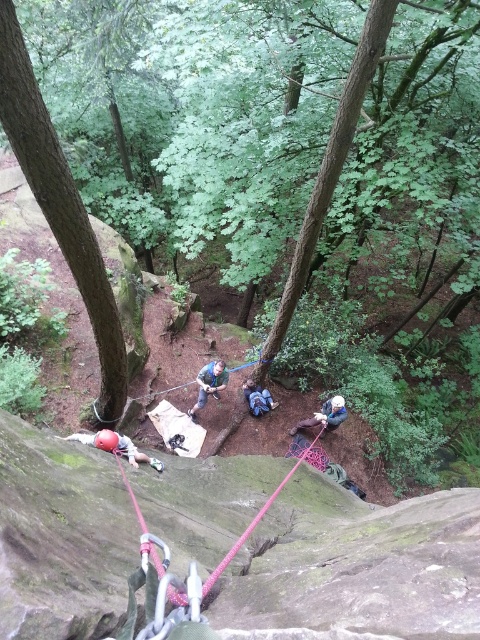
You are a safety inspector assessing the climbing setup. The safety protocol requires that the distance between the blue fabric shirt at center and the matte red helmet at lower left must be at least 2 meters to ensure proper rope slack. Is the current distance compliant with this requirement?

The distance between the blue fabric shirt at center and the matte red helmet at lower left is 2.35 meters, which exceeds the required 2 meters. Therefore, the current setup complies with the safety protocol.

You are a hiker standing at the base of the rock face. You see a blue fabric shirt at center and a matte red helmet at lower left. Which object is higher up on the rock face?

The blue fabric shirt at center is taller than the matte red helmet at lower left, so the blue fabric shirt at center is higher up on the rock face.